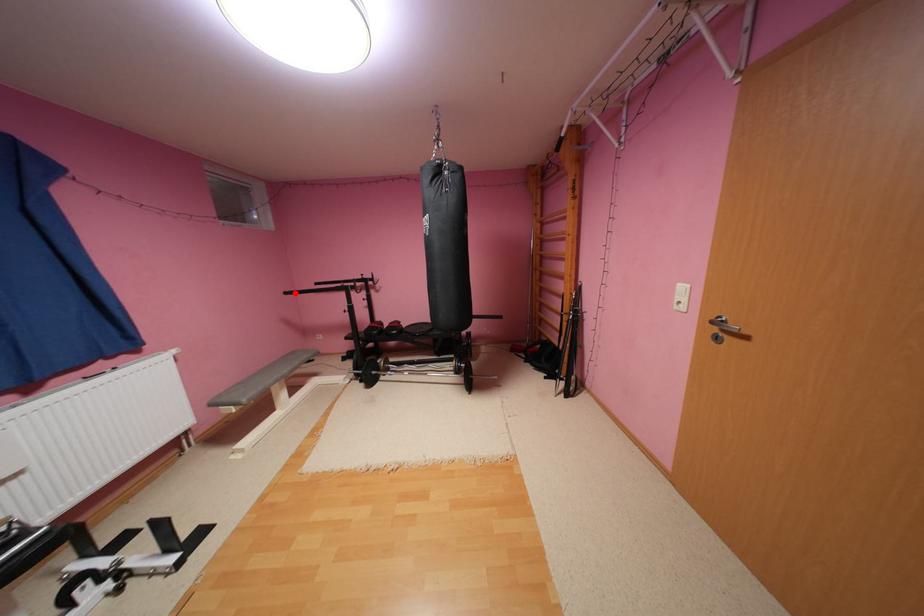
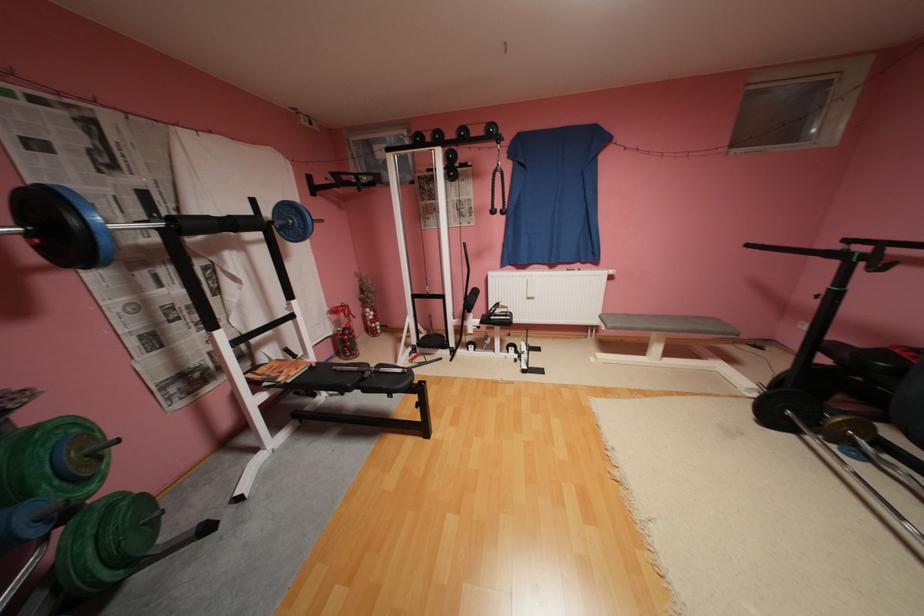
In the second image, find the point that corresponds to the highlighted location in the first image.

(757, 246)